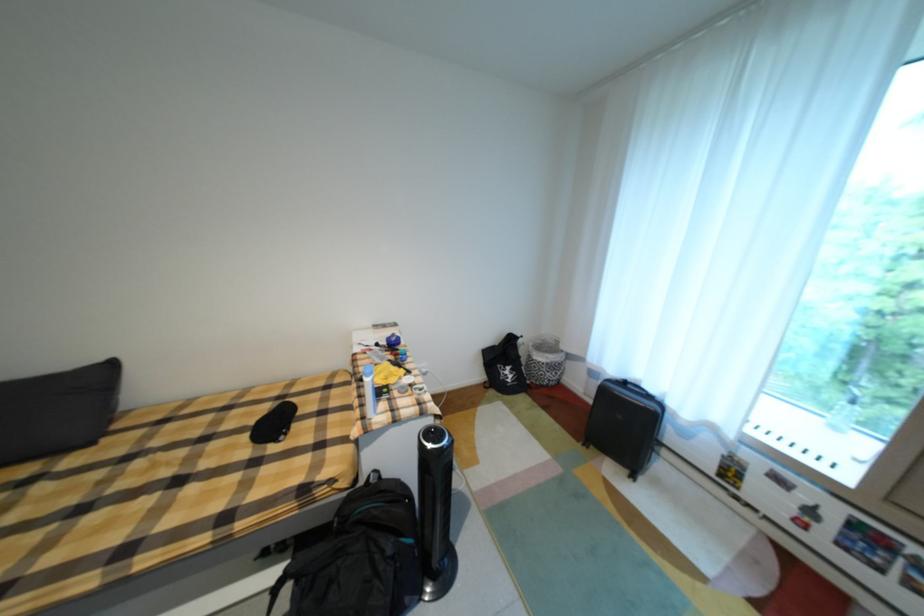
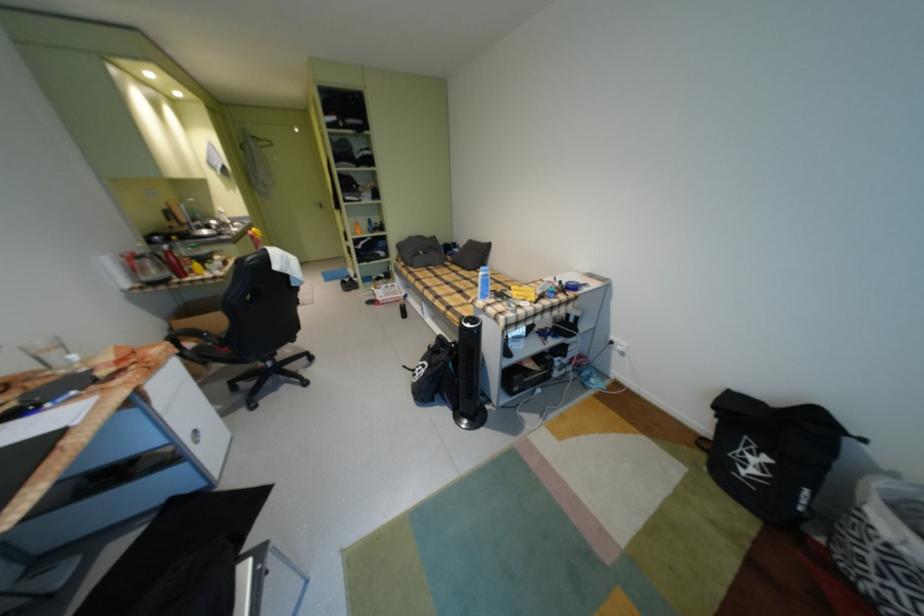
In the second image, find the point that corresponds to [103,445] in the first image.

(479, 272)